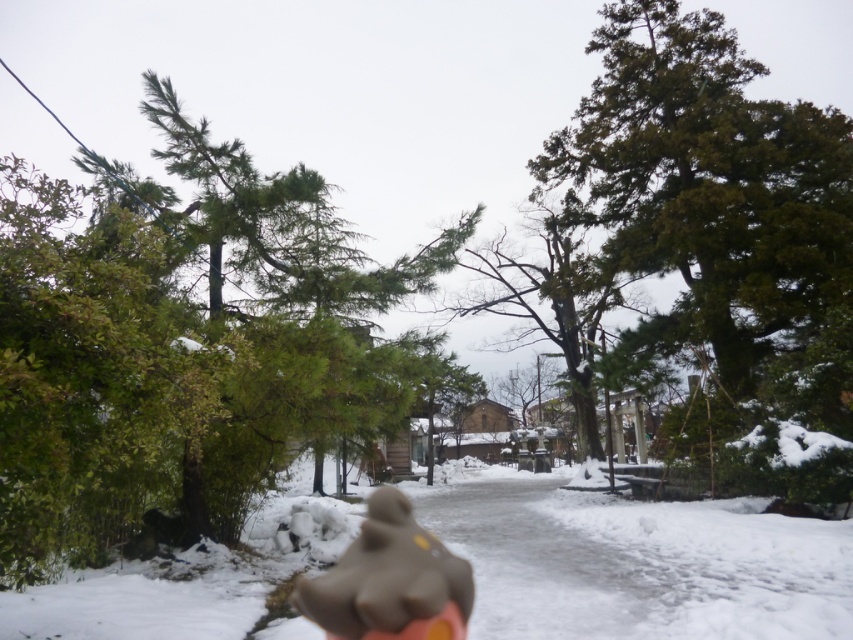
Does white fluffy snow at center have a smaller size compared to brown matte teddy bear at center?

Incorrect, white fluffy snow at center is not smaller in size than brown matte teddy bear at center.

Is white fluffy snow at center bigger than brown matte teddy bear at center?

Yes, white fluffy snow at center is bigger than brown matte teddy bear at center.

This screenshot has width=853, height=640. What are the coordinates of `white fluffy snow at center` in the screenshot? It's located at (636, 561).

Between green textured tree at upper right and brown matte teddy bear at center, which one has more height?

With more height is green textured tree at upper right.

Who is positioned more to the left, green textured tree at upper right or brown matte teddy bear at center?

brown matte teddy bear at center is more to the left.

Who is more forward, (833, 195) or (337, 605)?

Point (337, 605) is more forward.

Image resolution: width=853 pixels, height=640 pixels. I want to click on green textured tree at upper right, so click(x=722, y=236).

Is point (357, 420) less distant than point (827, 136)?

Yes, point (357, 420) is closer to viewer.

Which is more to the left, green matte tree at upper left or green textured tree at upper right?

green matte tree at upper left is more to the left.

Who is more forward, (44, 349) or (763, 72)?

Positioned in front is point (44, 349).

Locate an element on the screen. The height and width of the screenshot is (640, 853). green matte tree at upper left is located at coordinates (183, 342).